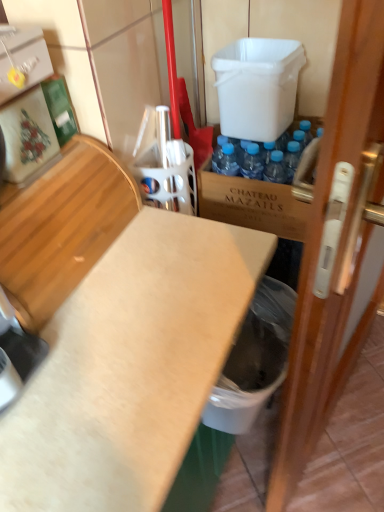
Question: From the image's perspective, is wooden door at right positioned above or below brown wooden crate at center?

Choices:
 (A) below
 (B) above

Answer: (A)

Question: In the image, is wooden door at right on the left side or the right side of brown wooden crate at center?

Choices:
 (A) right
 (B) left

Answer: (A)

Question: Which is nearer to the white plastic container at upper center?

Choices:
 (A) brown wooden crate at center
 (B) light brown wood at left
 (C) wooden door at right
 (D) white matte countertop at center
 (E) white plastic trash can at lower right

Answer: (A)

Question: Which object is the farthest from the brown wooden crate at center?

Choices:
 (A) light brown wood at left
 (B) white plastic container at upper center
 (C) wooden door at right
 (D) white plastic trash can at lower right
 (E) white matte countertop at center

Answer: (C)